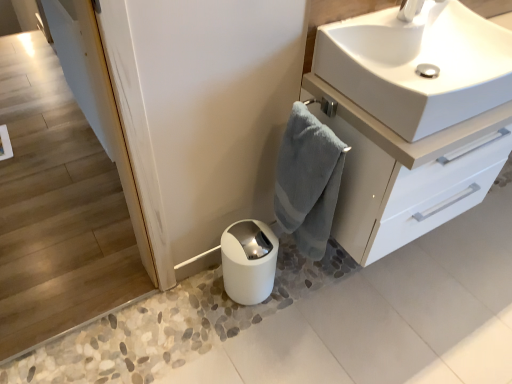
The image size is (512, 384). What are the coordinates of `free space in front of white glossy toilet paper at lower center` in the screenshot? It's located at (246, 336).